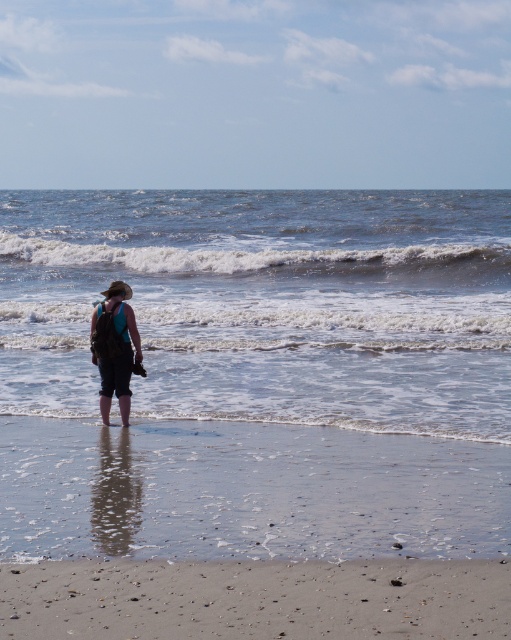
Question: Can you confirm if clear water at lower center is positioned to the right of smooth beige sand at lower center?

Choices:
 (A) yes
 (B) no

Answer: (B)

Question: Is clear water at lower center to the left of smooth beige sand at lower center from the viewer's perspective?

Choices:
 (A) yes
 (B) no

Answer: (A)

Question: Estimate the real-world distances between objects in this image. Which object is closer to the matte black backpack at center?

Choices:
 (A) smooth beige sand at lower center
 (B) clear water at lower center

Answer: (A)

Question: Estimate the real-world distances between objects in this image. Which object is closer to the clear water at lower center?

Choices:
 (A) matte black backpack at center
 (B) smooth beige sand at lower center

Answer: (B)

Question: Estimate the real-world distances between objects in this image. Which object is closer to the clear water at lower center?

Choices:
 (A) smooth beige sand at lower center
 (B) matte black backpack at center

Answer: (A)

Question: Is clear water at lower center positioned at the back of matte black backpack at center?

Choices:
 (A) no
 (B) yes

Answer: (B)